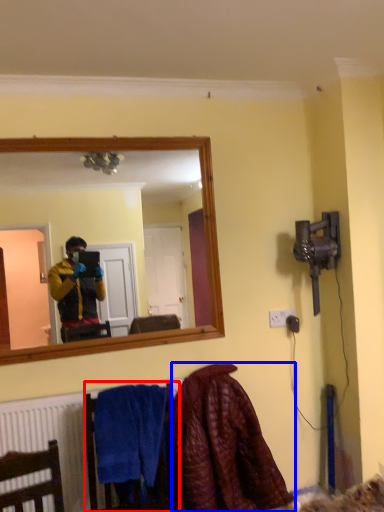
Question: Which point is further to the camera, armchair (highlighted by a red box) or blanket (highlighted by a blue box)?

Choices:
 (A) armchair
 (B) blanket

Answer: (B)